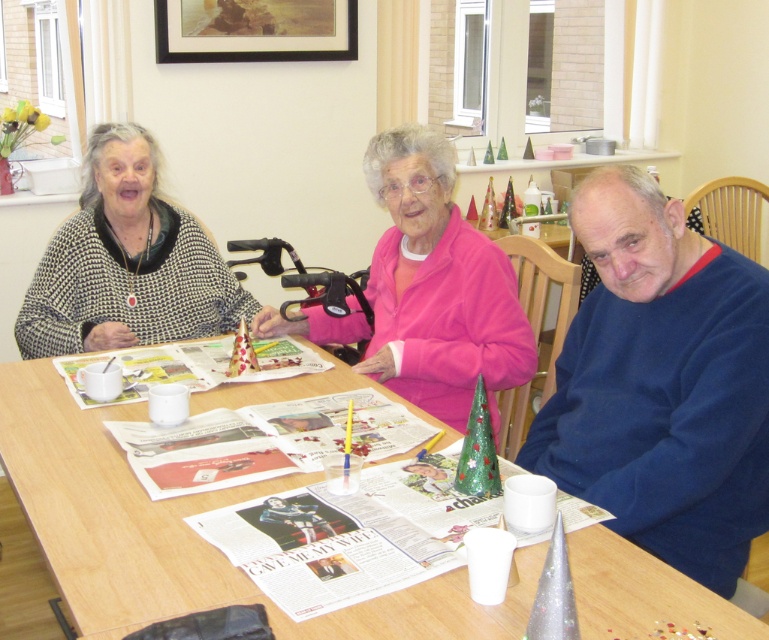
Is pink fleece jacket at center taller than knitted sweater at left?

Indeed, pink fleece jacket at center has a greater height compared to knitted sweater at left.

Between point (475, 323) and point (120, 273), which one is positioned behind?

Point (120, 273)

Where is `pink fleece jacket at center`? The image size is (769, 640). pink fleece jacket at center is located at coordinates (428, 289).

Between blue fleece sweater at right and pink fleece jacket at center, which one has more height?

With more height is blue fleece sweater at right.

Looking at this image, can you confirm if blue fleece sweater at right is thinner than pink fleece jacket at center?

Yes, blue fleece sweater at right is thinner than pink fleece jacket at center.

At what (x,y) coordinates should I click in order to perform the action: click on blue fleece sweater at right. Please return your answer as a coordinate pair (x, y). The width and height of the screenshot is (769, 640). Looking at the image, I should click on (661, 384).

Image resolution: width=769 pixels, height=640 pixels. I want to click on wooden table at center, so click(181, 532).

Which is in front, point (217, 397) or point (415, 333)?

Point (217, 397) is in front.

Who is more forward, (420, 602) or (252, 330)?

Point (420, 602) is more forward.

The height and width of the screenshot is (640, 769). Identify the location of wooden table at center. (181, 532).